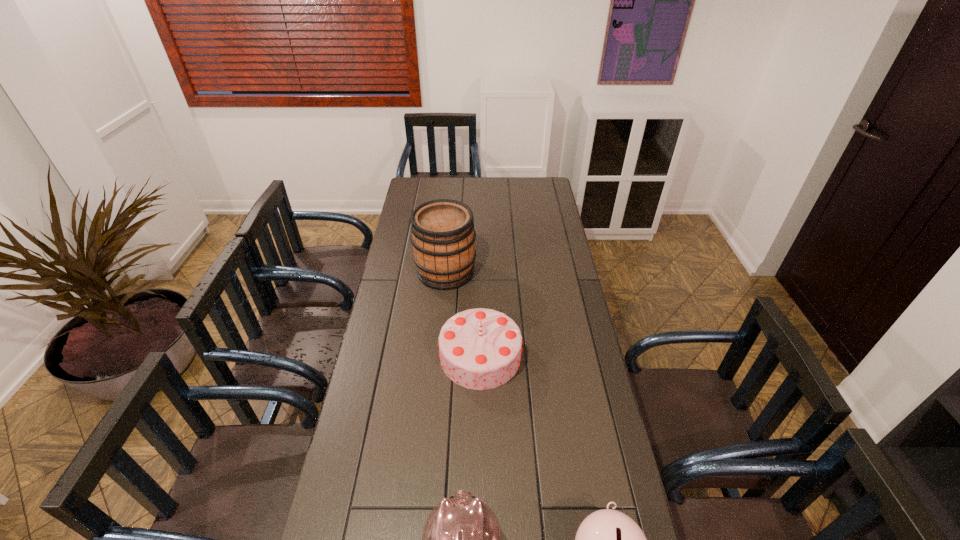
Locate an element on the screen. Image resolution: width=960 pixels, height=540 pixels. cider is located at coordinates (x=443, y=236).

At what (x,y) coordinates should I click in order to perform the action: click on the farthest object. Please return your answer as a coordinate pair (x, y). This screenshot has width=960, height=540. Looking at the image, I should click on (443, 236).

Where is `the second farthest object`? the second farthest object is located at coordinates (480, 348).

The image size is (960, 540). What are the coordinates of `vacant position located on the right of the cider` in the screenshot? It's located at (526, 272).

This screenshot has width=960, height=540. I want to click on vacant space situated on the right of the third nearest object, so [x=571, y=356].

Identify the location of object that is positioned at the left edge. The height and width of the screenshot is (540, 960). coord(443,236).

In the image, there is a desktop. In order to click on vacant space at the far edge in this screenshot , I will do `click(456, 199)`.

What are the coordinates of `blank space at the left edge` in the screenshot? It's located at (404, 279).

The image size is (960, 540). Identify the location of free space at the right edge. (585, 465).

Identify the location of free space at the far right corner of the desktop. (x=547, y=177).